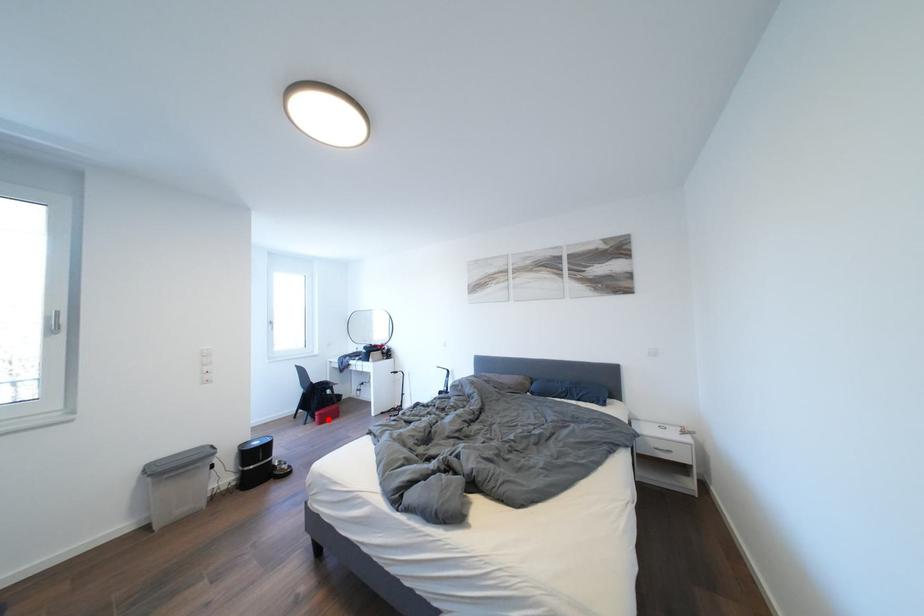
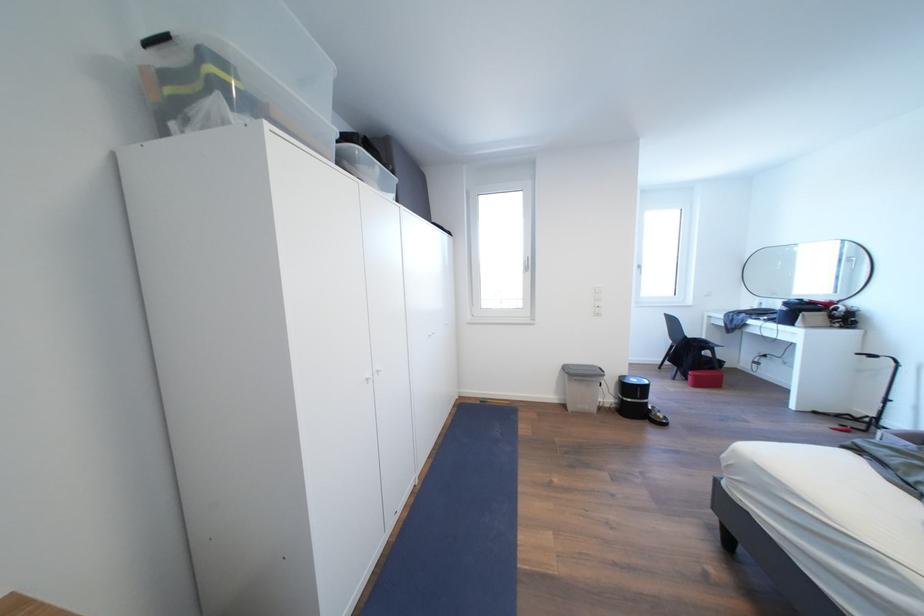
In the second image, find the point that corresponds to the highlighted location in the first image.

(703, 381)